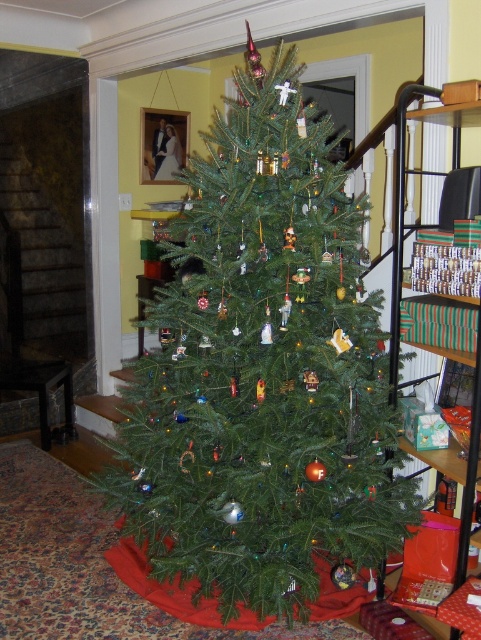
Question: Does green matte christmas tree at center appear on the left side of green striped fabric at right?

Choices:
 (A) yes
 (B) no

Answer: (A)

Question: Can you confirm if green matte christmas tree at center is thinner than green striped fabric at right?

Choices:
 (A) yes
 (B) no

Answer: (B)

Question: Is green matte christmas tree at center below green striped fabric at right?

Choices:
 (A) no
 (B) yes

Answer: (B)